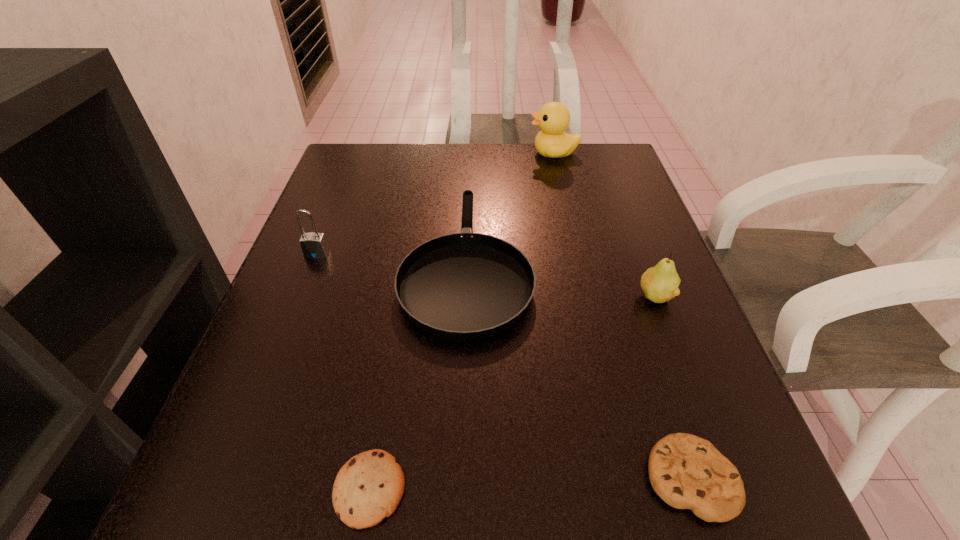
Locate an element on the screen. The height and width of the screenshot is (540, 960). vacant region that satisfies the following two spatial constraints: 1. on the back side of the second shortest object; 2. on the left side of the shorter cookie is located at coordinates (372, 478).

You are a GUI agent. You are given a task and a screenshot of the screen. Output one action in this format:
    pyautogui.click(x=<x>, y=<y>)
    Task: Click on the vacant space that satisfies the following two spatial constraints: 1. on the face of the fifth tallest object; 2. on the right side of the farthest object
    This screenshot has width=960, height=540.
    Given the screenshot: What is the action you would take?
    pyautogui.click(x=629, y=478)

Identify the location of vacant space that satisfies the following two spatial constraints: 1. on the face of the farthest object; 2. on the shackle of the leftmost object. (577, 254).

I want to click on vacant region that satisfies the following two spatial constraints: 1. on the back side of the left cookie; 2. on the right side of the pear, so click(x=402, y=296).

What are the coordinates of `free location that satisfies the following two spatial constraints: 1. on the face of the pear; 2. on the right side of the tallest object` in the screenshot? It's located at point(587,296).